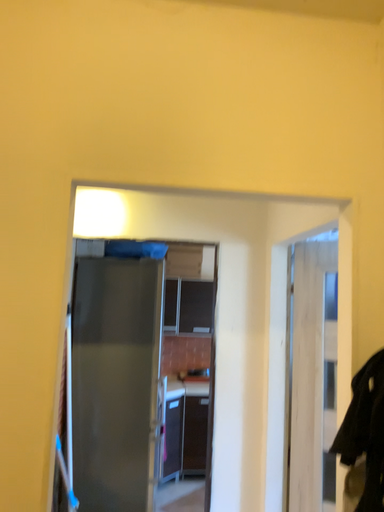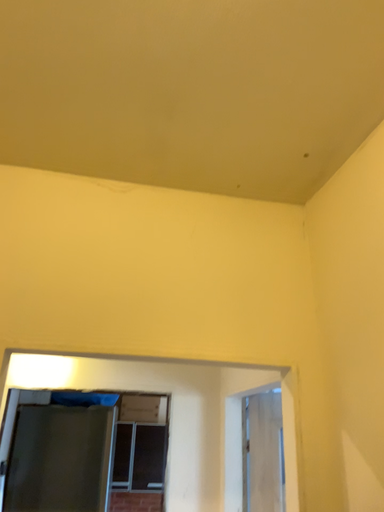
Question: How did the camera likely rotate when shooting the video?

Choices:
 (A) rotated upward
 (B) rotated downward

Answer: (A)